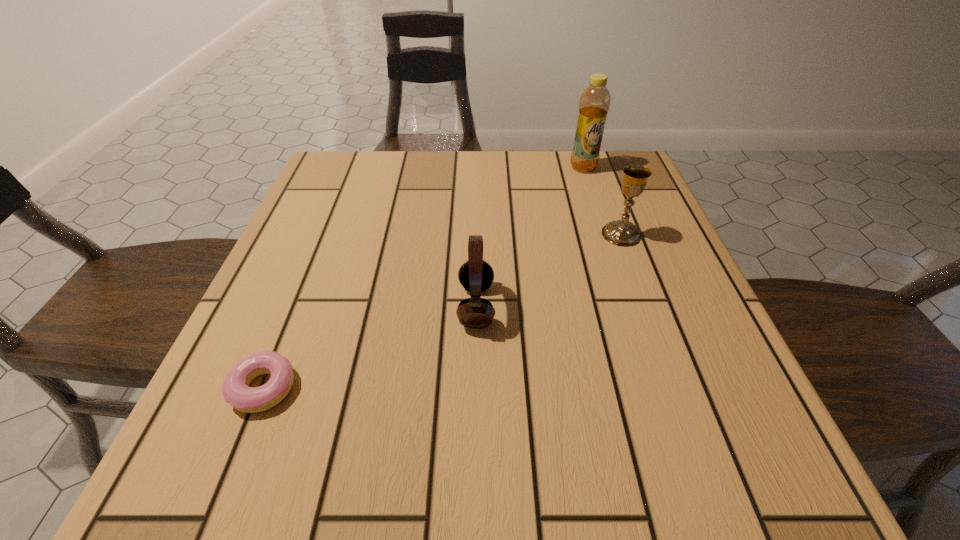
Identify the location of unoccupied area between the second farthest object and the farthest object. This screenshot has width=960, height=540. (602, 201).

This screenshot has height=540, width=960. What are the coordinates of `object that is the second closest to the second nearest object` in the screenshot? It's located at (622, 232).

Where is `the closest object to the bottle`? This screenshot has width=960, height=540. the closest object to the bottle is located at coordinates pos(622,232).

Where is `free space that satisfies the following two spatial constraints: 1. on the front side of the third nearest object; 2. on the ear pads of the headset`? free space that satisfies the following two spatial constraints: 1. on the front side of the third nearest object; 2. on the ear pads of the headset is located at coordinates (647, 306).

The height and width of the screenshot is (540, 960). Identify the location of free location that satisfies the following two spatial constraints: 1. on the back side of the chalice; 2. on the left side of the nearest object. (325, 234).

Find the location of a particular element. The image size is (960, 540). free space that satisfies the following two spatial constraints: 1. on the ear pads of the second nearest object; 2. on the front side of the leftmost object is located at coordinates tap(475, 388).

At what (x,y) coordinates should I click in order to perform the action: click on free point that satisfies the following two spatial constraints: 1. on the back side of the chalice; 2. on the left side of the nearest object. Please return your answer as a coordinate pair (x, y). Looking at the image, I should click on (325, 234).